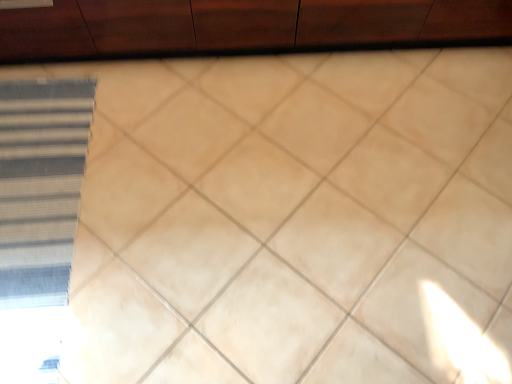
In order to face textured beige curtain at left, should I rotate leftwards or rightwards?

To align with it, rotate left about 28.086°.

Describe the element at coordinates (40, 186) in the screenshot. Image resolution: width=512 pixels, height=384 pixels. I see `textured beige curtain at left` at that location.

The width and height of the screenshot is (512, 384). In order to click on textured beige curtain at left in this screenshot , I will do `click(40, 186)`.

Identify the location of textured beige curtain at left. This screenshot has width=512, height=384. (40, 186).